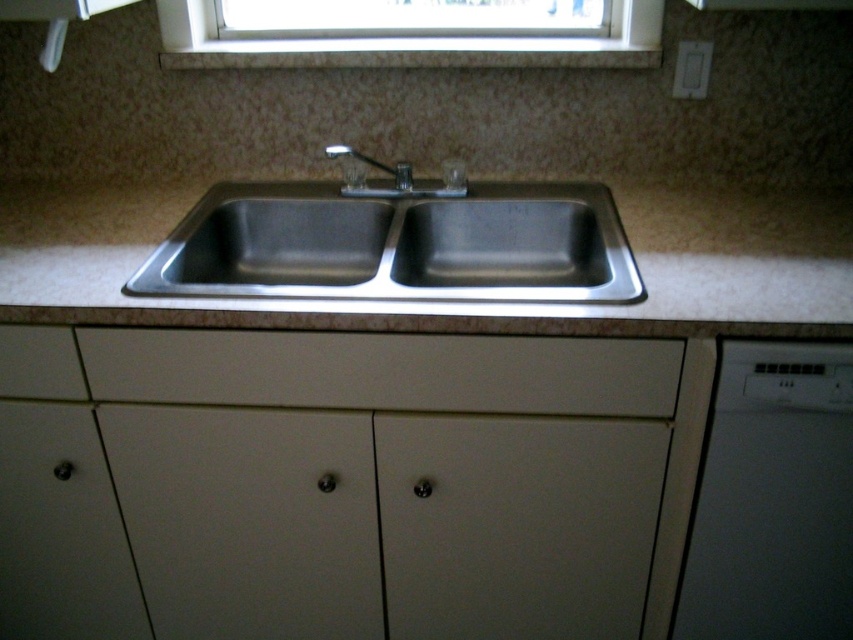
Is silver metallic sink at center to the right of white plastic dishwasher at right from the viewer's perspective?

No, silver metallic sink at center is not to the right of white plastic dishwasher at right.

The image size is (853, 640). I want to click on silver metallic sink at center, so click(454, 301).

Can you confirm if white matte drawer at center is thinner than clear glass window at upper center?

Indeed, white matte drawer at center has a lesser width compared to clear glass window at upper center.

Does white matte drawer at center have a greater height compared to clear glass window at upper center?

No.

Between point (651, 342) and point (254, 61), which one is positioned in front?

Point (651, 342) is in front.

Find the location of `white matte drawer at center`. white matte drawer at center is located at coordinates (383, 371).

In the scene shown: Is stainless steel sink at center further to camera compared to white matte drawer at center?

That is True.

Is stainless steel sink at center to the right of white matte drawer at center from the viewer's perspective?

Correct, you'll find stainless steel sink at center to the right of white matte drawer at center.

Between point (587, 262) and point (105, 369), which one is positioned in front?

Point (105, 369) is more forward.

The width and height of the screenshot is (853, 640). I want to click on stainless steel sink at center, so click(x=397, y=241).